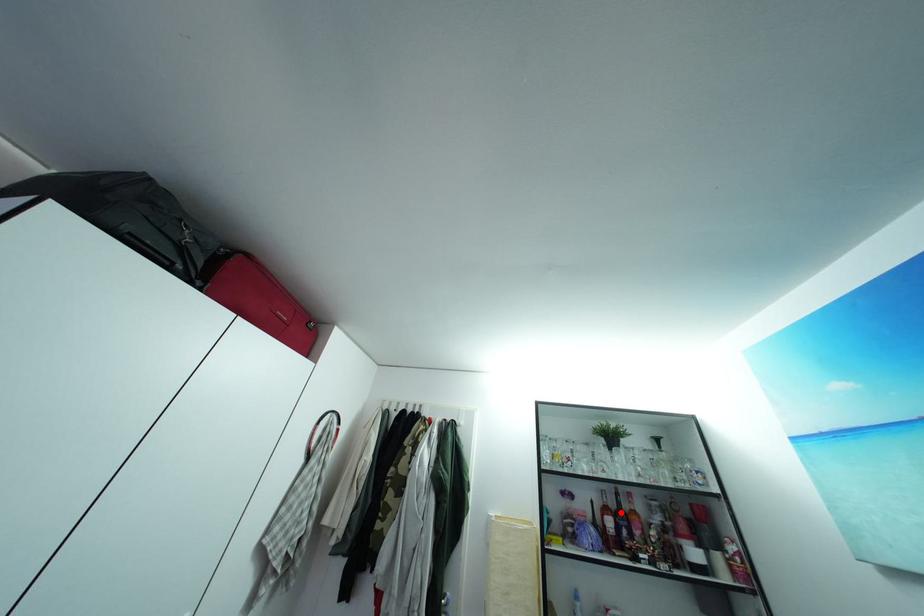
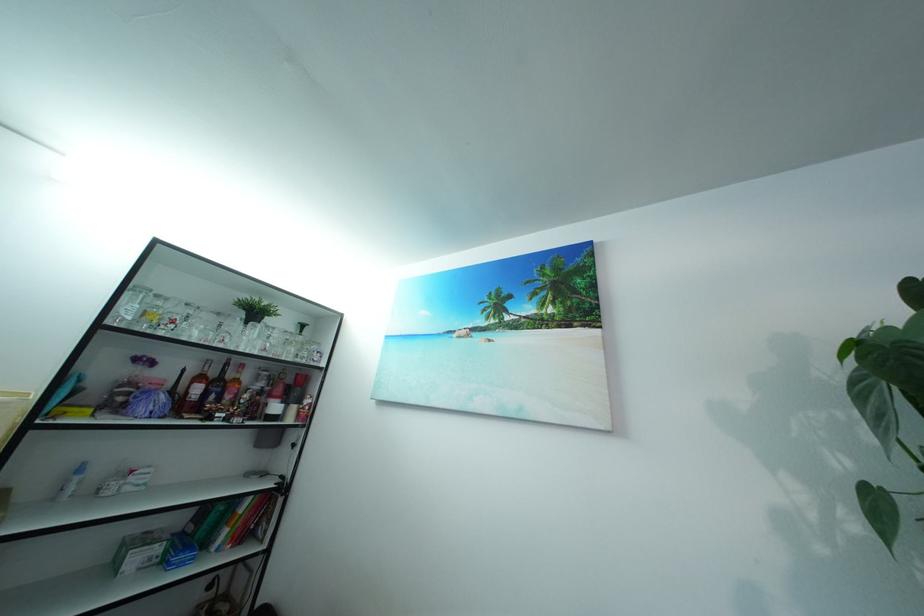
The point at the highlighted location is marked in the first image. Where is the corresponding point in the second image?

(222, 381)